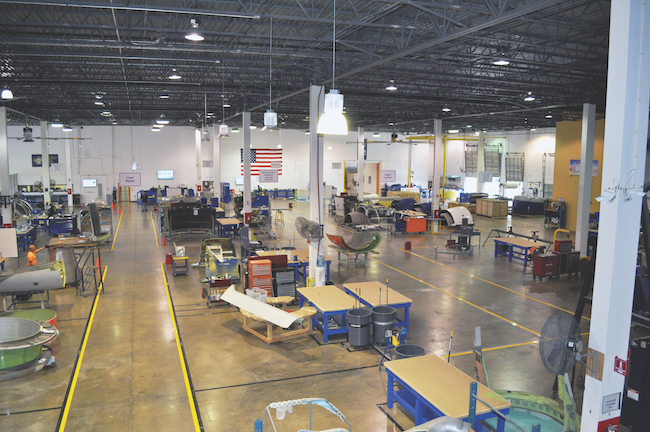
I want to click on column, so click(x=42, y=150), click(x=213, y=153).